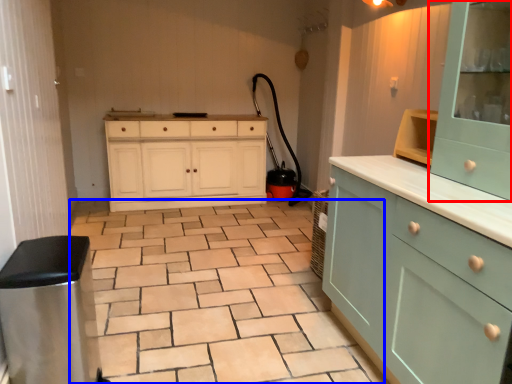
Question: Which object is further to the camera taking this photo, cabinetry (highlighted by a red box) or ceramic tile (highlighted by a blue box)?

Choices:
 (A) cabinetry
 (B) ceramic tile

Answer: (B)